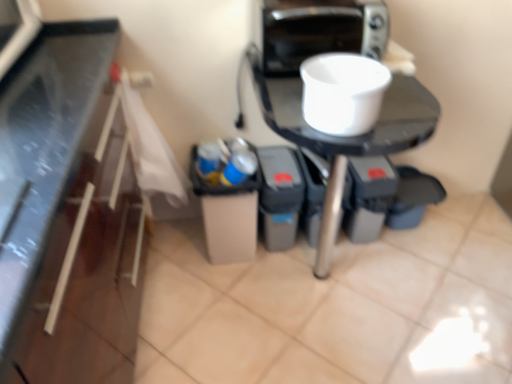
Find the location of a particular element. free point below white glossy table at center (from a real-world perspective) is located at coordinates (330, 285).